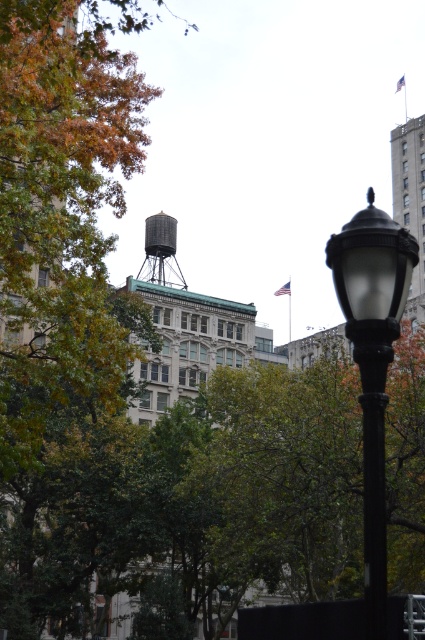
Is gray concrete building at upper right above metallic gray water tower at center?

Actually, gray concrete building at upper right is below metallic gray water tower at center.

Between point (411, 118) and point (153, 243), which one is positioned in front?

Point (153, 243) is in front.

Is point (408, 304) positioned after point (159, 282)?

No, it is in front of (159, 282).

Locate an element on the screen. gray concrete building at upper right is located at coordinates (410, 202).

This screenshot has width=425, height=640. Describe the element at coordinates (373, 364) in the screenshot. I see `black matte street light at center right` at that location.

Can you confirm if black matte street light at center right is positioned above gray concrete building at upper right?

Incorrect, black matte street light at center right is not positioned above gray concrete building at upper right.

I want to click on black matte street light at center right, so click(x=373, y=364).

Between point (365, 339) and point (159, 240), which one is positioned behind?

Point (159, 240)

Who is more forward, (345, 243) or (178, 273)?

Point (345, 243)

Who is more distant from viewer, [365,419] or [164,275]?

Positioned behind is point [164,275].

Where is `black matte street light at center right`? black matte street light at center right is located at coordinates (373, 364).